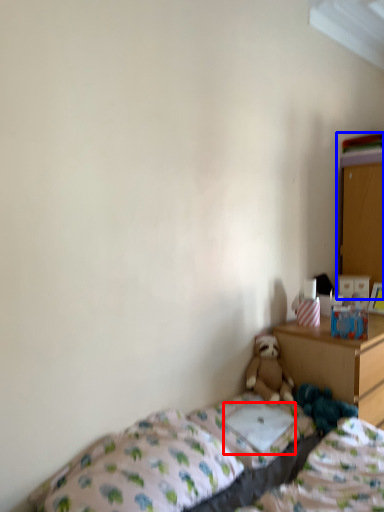
Question: Which point is further to the camera, pillow (highlighted by a red box) or dresser (highlighted by a blue box)?

Choices:
 (A) pillow
 (B) dresser

Answer: (B)